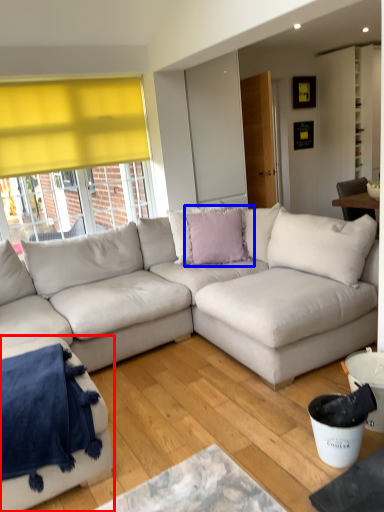
Question: Which point is closer to the camera, studio couch (highlighted by a red box) or pillow (highlighted by a blue box)?

Choices:
 (A) studio couch
 (B) pillow

Answer: (A)